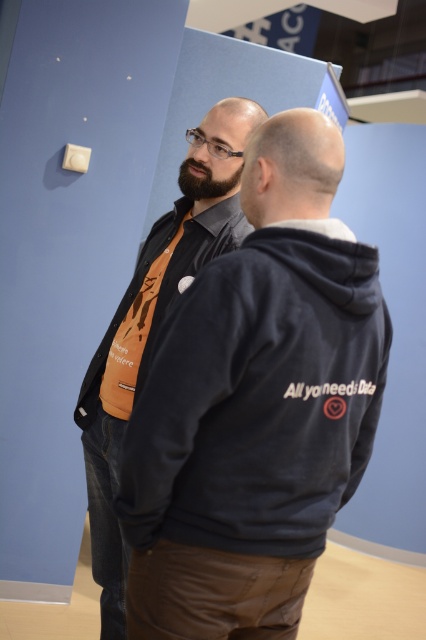
You are a photographer setting up a shoot in this scene. You need to position a light source so that it illuminates both the dark blue fleece at center and the matte black hoodie at center equally. Considering their sizes, which object should you place the light closer to?

The dark blue fleece at center is smaller than the matte black hoodie at center. To ensure equal illumination, the light source should be placed closer to the dark blue fleece at center since it is smaller and requires less light to achieve the same brightness as the larger matte black hoodie at center.

You are standing in the room and want to place a small plant between the two points, point (167, 314) and point (169, 298). Which point should the plant be closer to in order to be nearer to the viewer?

The plant should be placed closer to point (167, 314) because it is closer to the viewer than point (169, 298).

You are a security guard in the conference room. You need to ensure that people maintain a minimum distance of 1.5 meters for social distancing. There are two people at point (127, 387). Are they violating the social distancing rule?

The two people at point (127, 387) are 1.75 meters apart, which is above the 1.5 meters requirement. Therefore, they are not violating the social distancing rule.